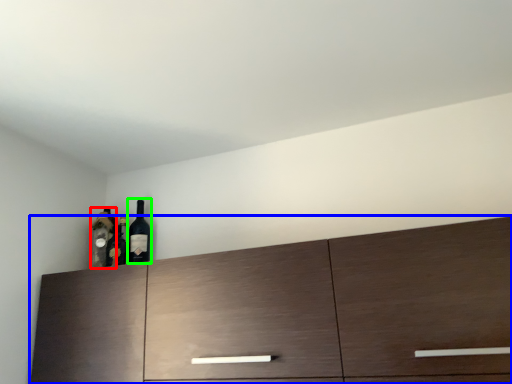
Question: Which object is the closest to the bottle (highlighted by a red box)? Choose among these: cabinetry (highlighted by a blue box) or wine bottle (highlighted by a green box).

Choices:
 (A) cabinetry
 (B) wine bottle

Answer: (B)